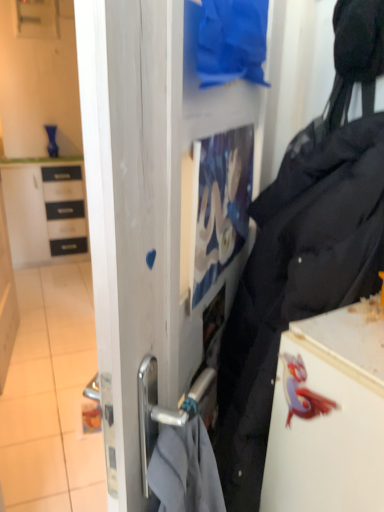
Question: Would you consider white glossy tile at lower left to be distant from white glossy fridge at lower right?

Choices:
 (A) no
 (B) yes

Answer: (B)

Question: From a real-world perspective, is white glossy tile at lower left over white glossy fridge at lower right?

Choices:
 (A) yes
 (B) no

Answer: (B)

Question: Does white glossy tile at lower left have a greater width compared to white glossy fridge at lower right?

Choices:
 (A) no
 (B) yes

Answer: (B)

Question: Can you confirm if white glossy tile at lower left is positioned to the right of white glossy fridge at lower right?

Choices:
 (A) yes
 (B) no

Answer: (B)

Question: Can you confirm if white glossy tile at lower left is thinner than white glossy fridge at lower right?

Choices:
 (A) no
 (B) yes

Answer: (A)

Question: From the image's perspective, is white glossy cabinet at left located above or below white glossy tile at lower left?

Choices:
 (A) above
 (B) below

Answer: (A)

Question: Is white glossy cabinet at left bigger or smaller than white glossy tile at lower left?

Choices:
 (A) big
 (B) small

Answer: (A)

Question: From a real-world perspective, is white glossy cabinet at left physically located above or below white glossy tile at lower left?

Choices:
 (A) below
 (B) above

Answer: (B)

Question: Is point (31, 172) closer or farther from the camera than point (72, 507)?

Choices:
 (A) farther
 (B) closer

Answer: (A)

Question: In terms of width, does white glossy tile at lower left look wider or thinner when compared to transparent glass door at center?

Choices:
 (A) thin
 (B) wide

Answer: (B)

Question: From the image's perspective, is white glossy tile at lower left positioned above or below transparent glass door at center?

Choices:
 (A) above
 (B) below

Answer: (B)

Question: Is white glossy tile at lower left bigger or smaller than transparent glass door at center?

Choices:
 (A) big
 (B) small

Answer: (B)

Question: Considering the positions of white glossy tile at lower left and transparent glass door at center in the image, is white glossy tile at lower left taller or shorter than transparent glass door at center?

Choices:
 (A) tall
 (B) short

Answer: (B)

Question: From a real-world perspective, is white glossy cabinet at left above or below black matte tote bag at center-right?

Choices:
 (A) above
 (B) below

Answer: (B)

Question: Would you say white glossy cabinet at left is inside or outside black matte tote bag at center-right?

Choices:
 (A) inside
 (B) outside

Answer: (B)